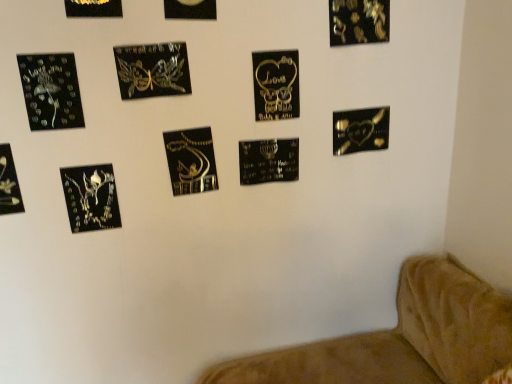
Question: Can you confirm if black glossy heart at lower right, placed as the 11th picture frame when sorted from left to right, is smaller than metallic gold picture frame at upper left, marked as the 8th picture frame in a right-to-left arrangement?

Choices:
 (A) yes
 (B) no

Answer: (B)

Question: Is black glossy heart at lower right, placed as the 11th picture frame when sorted from left to right, directly adjacent to metallic gold picture frame at upper left, marked as the 8th picture frame in a right-to-left arrangement?

Choices:
 (A) no
 (B) yes

Answer: (A)

Question: From the image's perspective, is black glossy heart at lower right, placed as the 11th picture frame when sorted from left to right, over metallic gold picture frame at upper left, positioned as the 4th picture frame in left-to-right order?

Choices:
 (A) no
 (B) yes

Answer: (A)

Question: From the image's perspective, is black glossy heart at lower right, placed as the 11th picture frame when sorted from left to right, located beneath metallic gold picture frame at upper left, positioned as the 4th picture frame in left-to-right order?

Choices:
 (A) no
 (B) yes

Answer: (B)

Question: Can we say black glossy heart at lower right, placed as the 11th picture frame when sorted from left to right, lies outside metallic gold picture frame at upper left, positioned as the 4th picture frame in left-to-right order?

Choices:
 (A) no
 (B) yes

Answer: (B)

Question: Does point (159, 64) appear closer or farther from the camera than point (82, 0)?

Choices:
 (A) closer
 (B) farther

Answer: (B)

Question: Considering the positions of metallic gold butterfly at upper center, marked as the fifth picture frame in a left-to-right arrangement, and metallic gold picture frame at upper left, marked as the 8th picture frame in a right-to-left arrangement, in the image, is metallic gold butterfly at upper center, marked as the fifth picture frame in a left-to-right arrangement, wider or thinner than metallic gold picture frame at upper left, marked as the 8th picture frame in a right-to-left arrangement,?

Choices:
 (A) wide
 (B) thin

Answer: (A)

Question: Based on their positions, is metallic gold butterfly at upper center, placed as the 7th picture frame when sorted from right to left, located to the left or right of metallic gold picture frame at upper left, positioned as the 4th picture frame in left-to-right order?

Choices:
 (A) right
 (B) left

Answer: (A)

Question: From the image's perspective, is metallic gold butterfly at upper center, marked as the fifth picture frame in a left-to-right arrangement, above or below metallic gold picture frame at upper left, marked as the 8th picture frame in a right-to-left arrangement?

Choices:
 (A) below
 (B) above

Answer: (A)

Question: Based on their sizes in the image, would you say matte black fairy at upper left, which is the 10th picture frame from right to left, is bigger or smaller than black glossy heart at lower right, placed as the 11th picture frame when sorted from left to right?

Choices:
 (A) big
 (B) small

Answer: (B)

Question: In the image, is matte black fairy at upper left, arranged as the second picture frame when viewed from the left, positioned in front of or behind black glossy heart at lower right, placed as the 11th picture frame when sorted from left to right?

Choices:
 (A) front
 (B) behind

Answer: (A)

Question: From the image's perspective, is matte black fairy at upper left, which is the 10th picture frame from right to left, above or below black glossy heart at lower right, which is the 1th picture frame in right-to-left order?

Choices:
 (A) above
 (B) below

Answer: (A)

Question: Is point (27, 87) positioned closer to the camera than point (379, 148)?

Choices:
 (A) closer
 (B) farther

Answer: (A)

Question: From their relative heights in the image, would you say black metallic plaque at center, placed as the third picture frame when sorted from right to left, is taller or shorter than metallic gold butterfly at upper center, marked as the fifth picture frame in a left-to-right arrangement?

Choices:
 (A) short
 (B) tall

Answer: (B)

Question: From the image's perspective, relative to metallic gold butterfly at upper center, placed as the 7th picture frame when sorted from right to left, is black metallic plaque at center, positioned as the ninth picture frame in left-to-right order, above or below?

Choices:
 (A) above
 (B) below

Answer: (B)